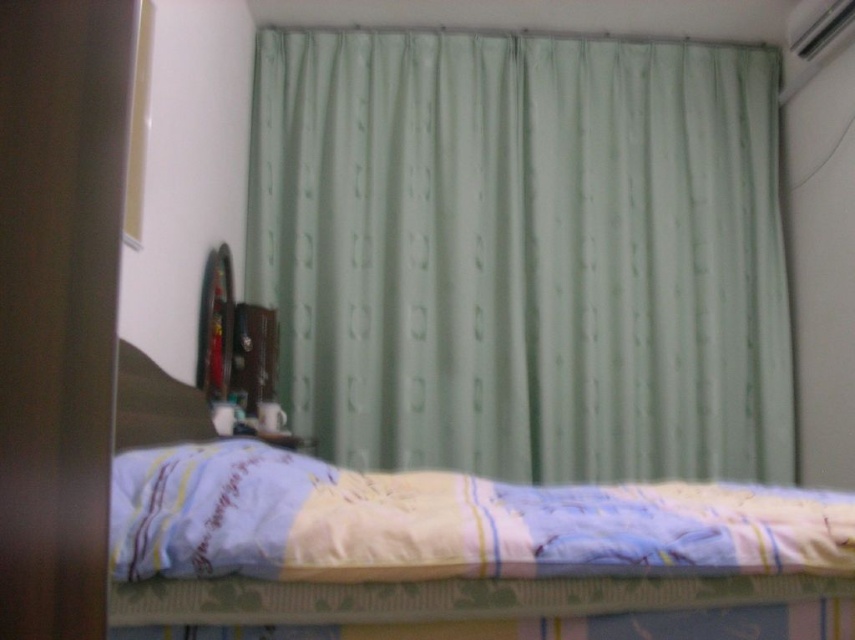
You are a painter who wants to hang a large painting on the wall behind the light green fabric curtain at upper center and the yellow fabric bed at lower center. Which object is better to place the painting above to ensure it is visible without blocking either?

The light green fabric curtain at upper center is much taller than the yellow fabric bed at lower center, so placing the painting above the light green fabric curtain at upper center would ensure it is visible without blocking either object.

You are standing in the bedroom described in the scene. There is a point at coordinates (453, 547). Which object in the scene is located at this point?

The point at coordinates (453, 547) corresponds to the yellow fabric bed at lower center.

You are organizing a small event in the bedroom and need to move a chair from the corner to the area near the bed. The chair is 1.2 meters wide. Can the chair fit between the yellow fabric bed at lower center and the brown fabric pillow at lower left without touching either?

The yellow fabric bed at lower center is positioned on the right side of brown fabric pillow at lower left. Since the distance between them isn not specified, we cannot determine if the chair will fit. Please provide more information about the space between them.